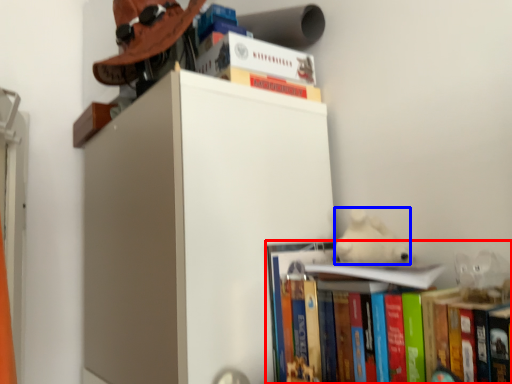
Question: Which object appears closest to the camera in this image, book (highlighted by a red box) or animal (highlighted by a blue box)?

Choices:
 (A) book
 (B) animal

Answer: (A)